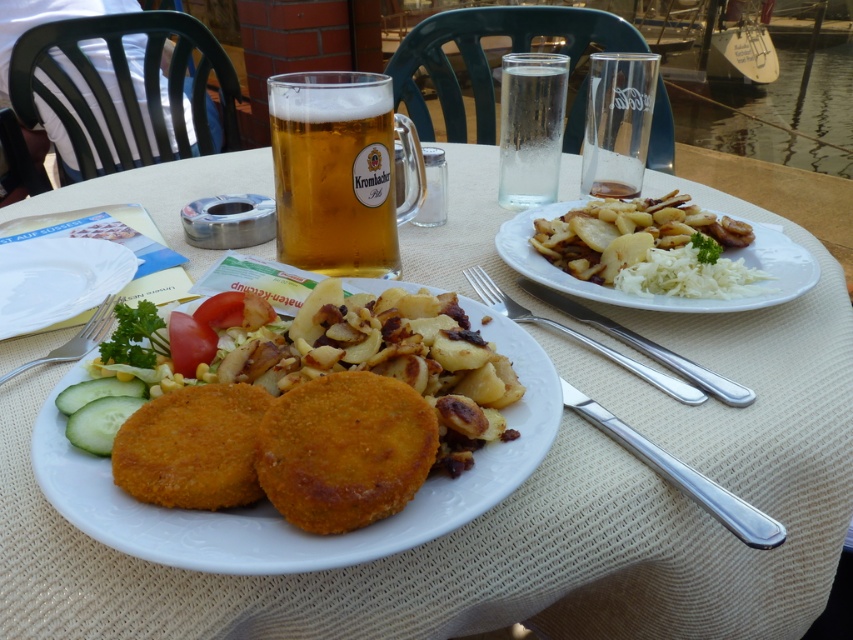
Between green crisp cucumber at center and green crisp cucumber at lower left, which one appears on the right side from the viewer's perspective?

green crisp cucumber at center is more to the right.

Can you confirm if green crisp cucumber at center is positioned above green crisp cucumber at lower left?

No.

Which is in front, point (91, 417) or point (62, 401)?

Point (91, 417) is more forward.

Image resolution: width=853 pixels, height=640 pixels. I want to click on green crisp cucumber at center, so click(100, 422).

The height and width of the screenshot is (640, 853). I want to click on white ceramic plate at center, so click(57, 280).

Is white ceramic plate at center taller than green crisp cucumber at lower left?

Indeed, white ceramic plate at center has a greater height compared to green crisp cucumber at lower left.

You are a GUI agent. You are given a task and a screenshot of the screen. Output one action in this format:
    pyautogui.click(x=<x>, y=<y>)
    Task: Click on the white ceramic plate at center
    This screenshot has height=640, width=853.
    Given the screenshot: What is the action you would take?
    pyautogui.click(x=57, y=280)

Is golden crispy cutlets at center taller than green crisp cucumber at lower left?

Yes, golden crispy cutlets at center is taller than green crisp cucumber at lower left.

This screenshot has height=640, width=853. Describe the element at coordinates (323, 416) in the screenshot. I see `golden crispy cutlets at center` at that location.

Which is behind, point (293, 449) or point (103, 396)?

The point (103, 396) is more distant.

Locate an element on the screen. golden crispy cutlets at center is located at coordinates (323, 416).